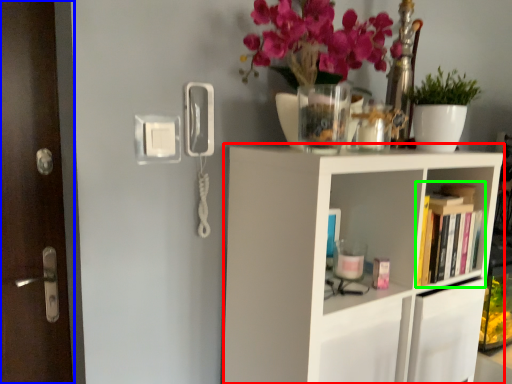
Question: Which object is the farthest from shelf (highlighted by a red box)? Choose among these: door (highlighted by a blue box) or book (highlighted by a green box).

Choices:
 (A) door
 (B) book

Answer: (A)